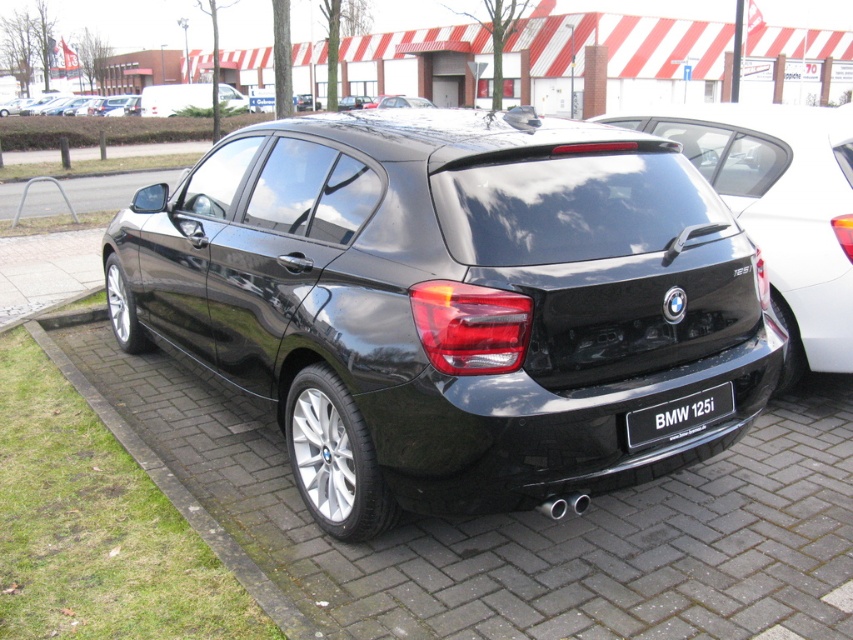
Question: Is glossy black car at center in front of black plastic license plate at center?

Choices:
 (A) yes
 (B) no

Answer: (A)

Question: Among these points, which one is nearest to the camera?

Choices:
 (A) (78, 99)
 (B) (819, 180)
 (C) (184, 99)

Answer: (B)

Question: Which of these objects is positioned closest to the black concrete curb at lower left?

Choices:
 (A) metallic silver minivan at upper left
 (B) black plastic license plate at center
 (C) matte black hatchback at center

Answer: (B)

Question: Is metallic silver minivan at upper left positioned before matte black hatchback at center?

Choices:
 (A) yes
 (B) no

Answer: (A)

Question: Does black concrete curb at lower left have a smaller size compared to black plastic license plate at center?

Choices:
 (A) yes
 (B) no

Answer: (B)

Question: Which of the following is the closest to the observer?

Choices:
 (A) black concrete curb at lower left
 (B) matte black hatchback at center
 (C) black glossy hatchback at center
 (D) black plastic license plate at center

Answer: (A)